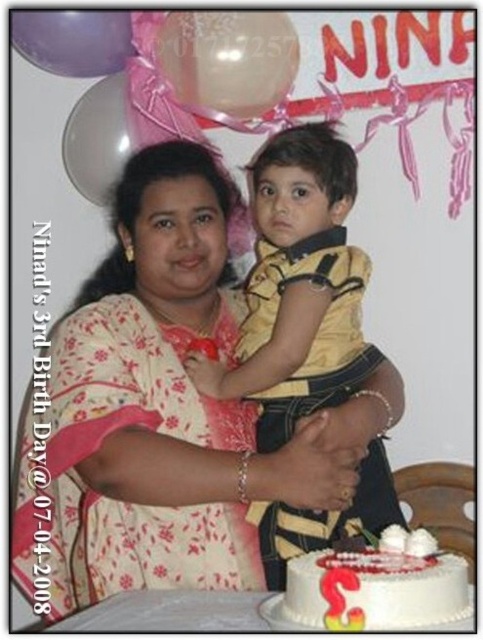
Question: In this image, where is floral fabric dress at center located relative to white frosted cake at lower right?

Choices:
 (A) right
 (B) left

Answer: (B)

Question: Which point appears closest to the camera in this image?

Choices:
 (A) (72, 308)
 (B) (275, 300)
 (C) (383, 547)

Answer: (C)

Question: Based on their relative distances, which object is nearer to the white frosted cake at lower right?

Choices:
 (A) floral fabric dress at center
 (B) yellow smooth shirt at center

Answer: (B)

Question: Which point is farther to the camera?

Choices:
 (A) white frosted cake at lower right
 (B) floral fabric dress at center
 (C) yellow smooth shirt at center

Answer: (C)

Question: Is yellow smooth shirt at center to the right of white frosted cake at lower right from the viewer's perspective?

Choices:
 (A) no
 (B) yes

Answer: (A)

Question: Can you confirm if floral fabric dress at center is positioned below white frosted cake at lower right?

Choices:
 (A) yes
 (B) no

Answer: (B)